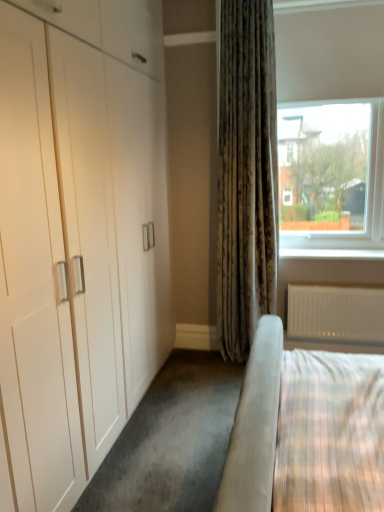
Question: Considering the positions of point (364, 249) and point (372, 305), is point (364, 249) closer or farther from the camera than point (372, 305)?

Choices:
 (A) closer
 (B) farther

Answer: (B)

Question: From the image's perspective, is white smooth window sill at lower right positioned above or below white textured radiator at lower right?

Choices:
 (A) above
 (B) below

Answer: (A)

Question: Based on their relative distances, which object is farther from the white smooth window sill at lower right?

Choices:
 (A) white textured radiator at lower right
 (B) clear glass window at upper right

Answer: (B)

Question: Which is farther from the white smooth window sill at lower right?

Choices:
 (A) white textured radiator at lower right
 (B) clear glass window at upper right

Answer: (B)